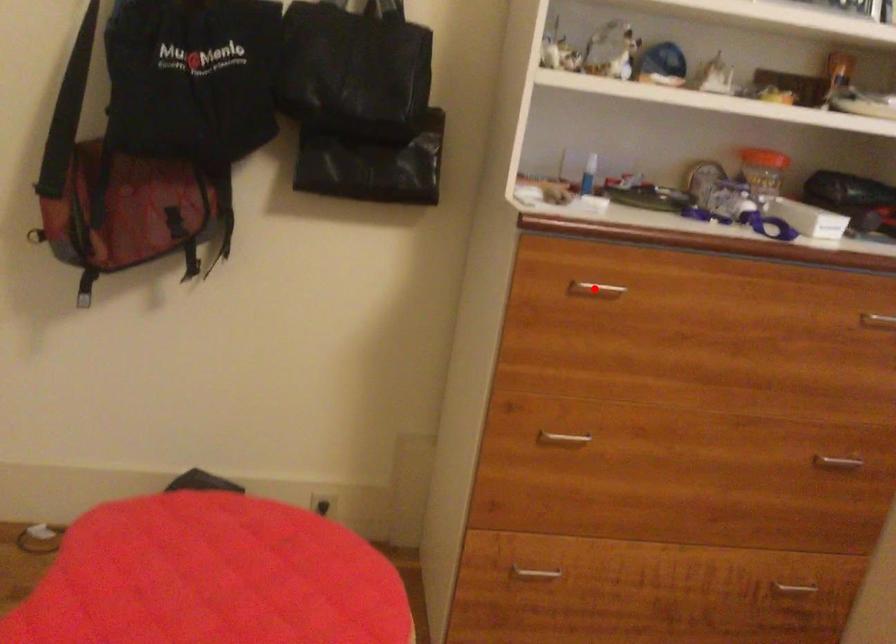
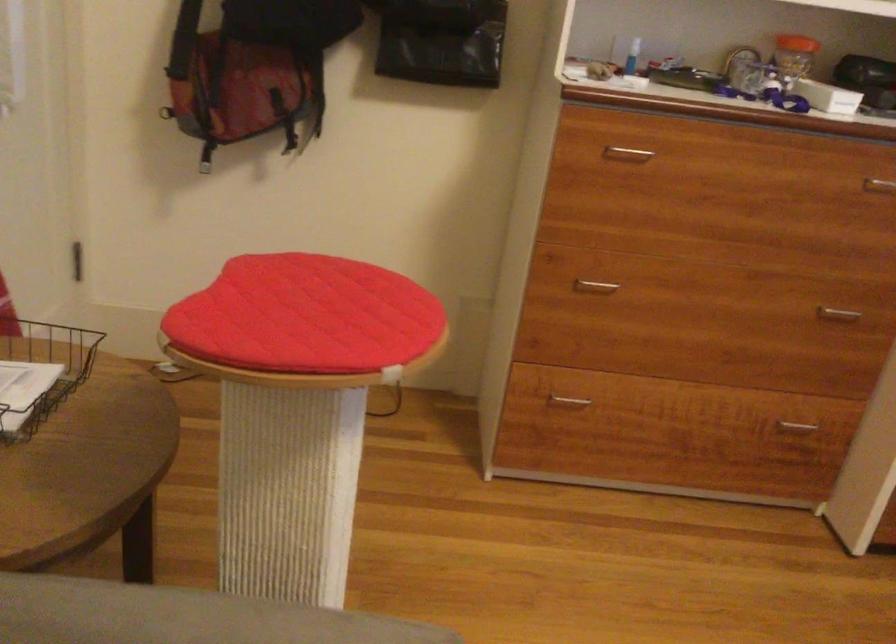
Locate, in the second image, the point that corresponds to the highlighted location in the first image.

(626, 154)